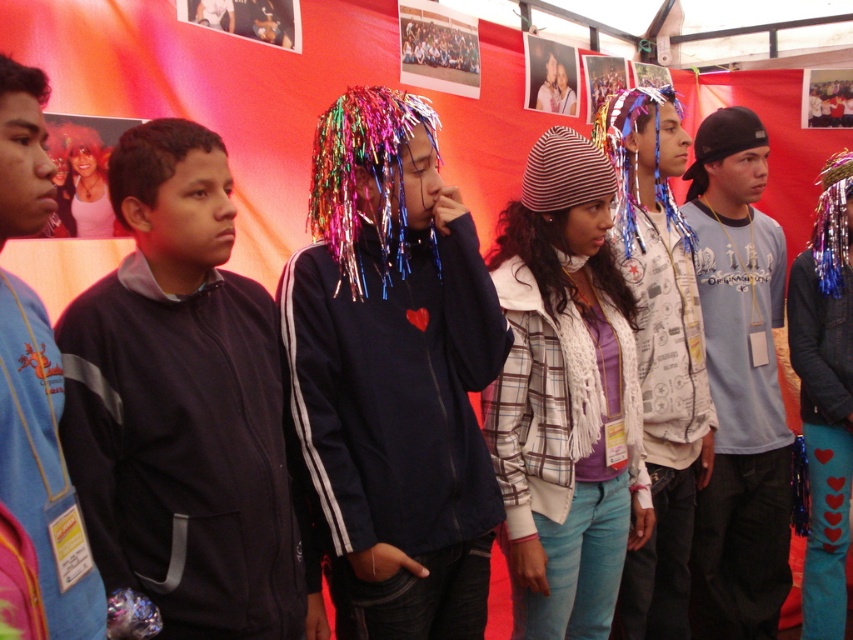
You are standing in front of the red backdrop and want to locate the black fleece jacket at left. According to the coordinates provided, where would you look to find it?

The black fleece jacket at left is located at coordinates point (x=186, y=408).

In the scene shown: You are organizing a photo shoot and need to arrange the black fleece jacket at left and the blue denim jeans at center in a straight line from left to right. Based on their current positions, which item should be placed first on the left side?

The black fleece jacket at left should be placed first on the left side since it is already positioned on the left side of the blue denim jeans at center.

You are organizing a clothing display and need to arrange the black fleece jacket at left and the shiny metallic jacket at center based on their widths. Which jacket should you place on the narrower rack designed for smaller items?

The black fleece jacket at left has a smaller width than the shiny metallic jacket at center, so it should be placed on the narrower rack designed for smaller items.